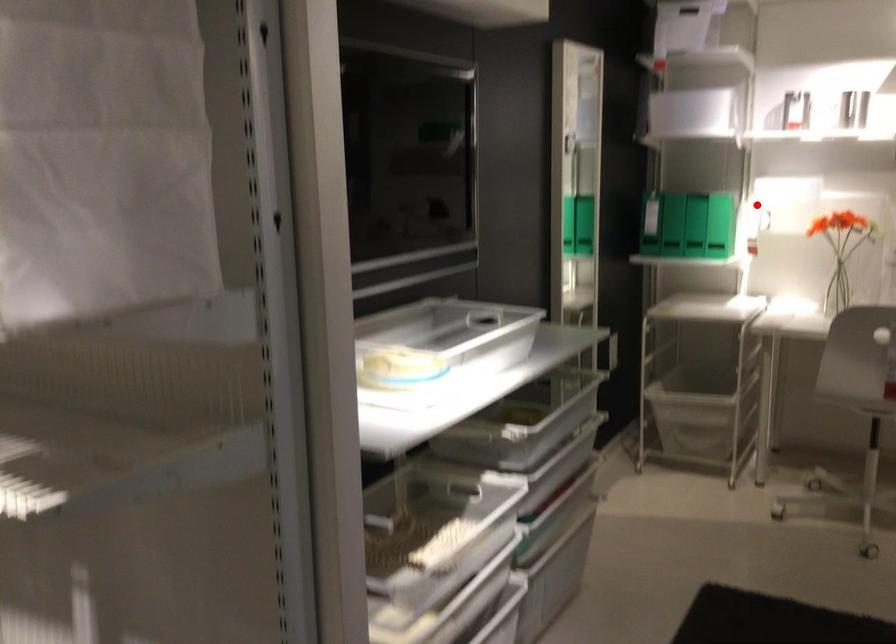
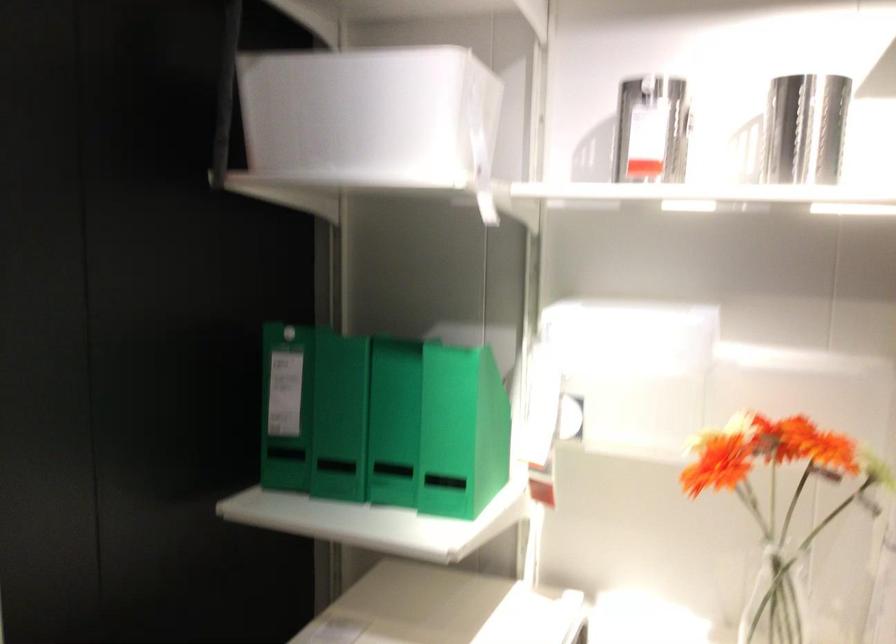
Question: A red point is marked in image1. In image2, is the corresponding 3D point closer to the camera or farther? Reply with the corresponding letter.

Choices:
 (A) The corresponding 3D point is closer.
 (B) The corresponding 3D point is farther.

Answer: (A)